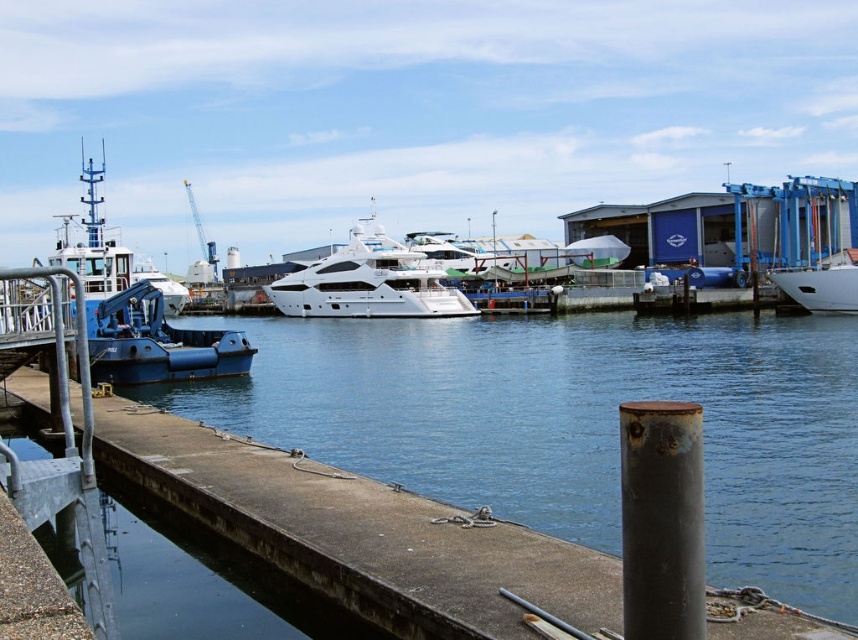
You are a boat owner planning to dock your new yacht at the marina. You see the smooth concrete dock at center and the white glossy yacht at center. Which one is more suitable for docking your yacht based on their sizes?

The white glossy yacht at center is larger than the smooth concrete dock at center, so it might not be suitable for docking there. Choose a dock that can accommodate its size.

You are a photographer planning to take a photo of the white glossy yacht at center and the white glossy boat at right. Since the sky is partly cloudy, you want to ensure both objects are fully visible. Which object should you position closer to the camera to avoid it being obscured by the other?

The white glossy yacht at center should be positioned closer to the camera because the white glossy boat at right is behind it, so moving the yacht forward will prevent the boat from blocking it.

You are a tour guide at the marina and want to direct visitors to the white glossy yacht at center. You see the white glossy boat at right nearby. Which direction should visitors turn to find the yacht?

The white glossy yacht at center is to the left of the white glossy boat at right, so visitors should turn left to find the yacht.